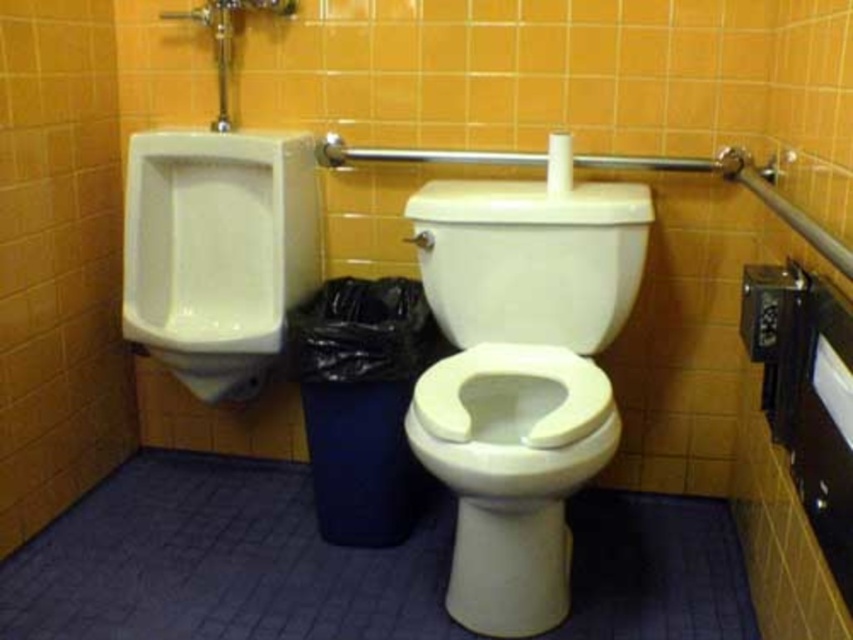
Question: Is white glossy urinal at left smaller than white glossy toilet lid at center?

Choices:
 (A) no
 (B) yes

Answer: (A)

Question: Is white glossy toilet bowl at center to the left of white glossy urinal at left from the viewer's perspective?

Choices:
 (A) yes
 (B) no

Answer: (B)

Question: Based on their relative distances, which object is farther from the white glossy toilet bowl at center?

Choices:
 (A) white glossy toilet lid at center
 (B) white glossy urinal at left

Answer: (B)

Question: Considering the real-world distances, which object is closest to the white glossy urinal at left?

Choices:
 (A) white glossy toilet lid at center
 (B) white glossy toilet bowl at center

Answer: (A)

Question: Can you confirm if white glossy toilet bowl at center is positioned to the left of white glossy toilet lid at center?

Choices:
 (A) no
 (B) yes

Answer: (B)

Question: Which object is positioned closest to the white glossy toilet bowl at center?

Choices:
 (A) white glossy urinal at left
 (B) white glossy toilet lid at center

Answer: (B)